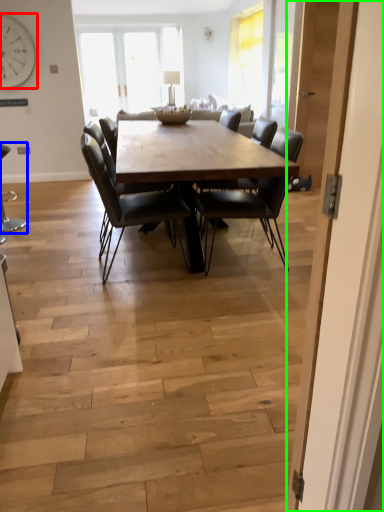
Question: Which object is the closest to the clock (highlighted by a red box)? Choose among these: chair (highlighted by a blue box) or door (highlighted by a green box).

Choices:
 (A) chair
 (B) door

Answer: (A)